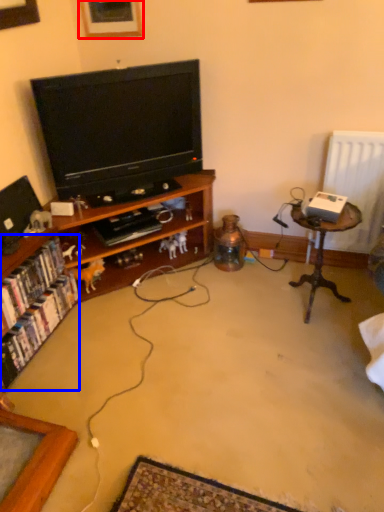
Question: Among these objects, which one is nearest to the camera, picture frame (highlighted by a red box) or book (highlighted by a blue box)?

Choices:
 (A) picture frame
 (B) book

Answer: (B)